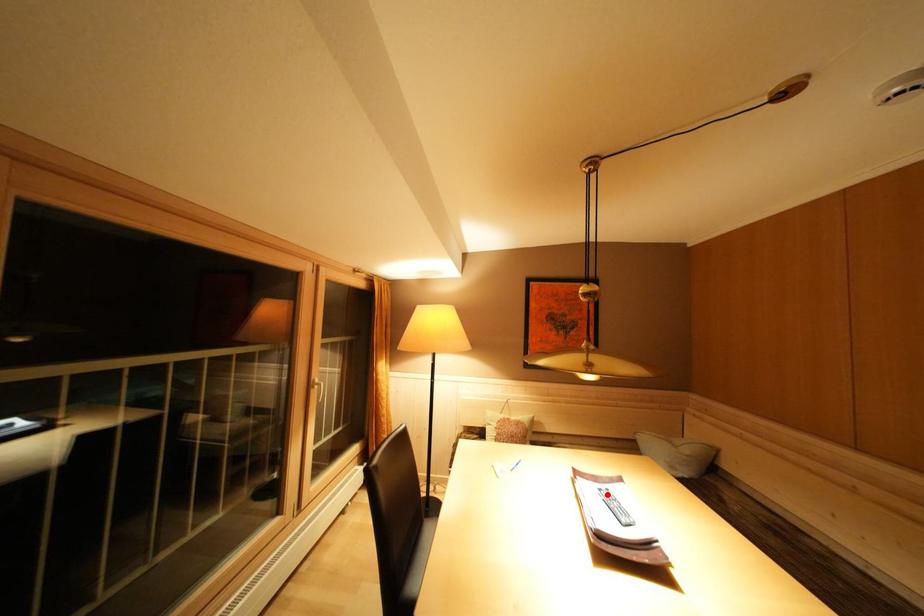
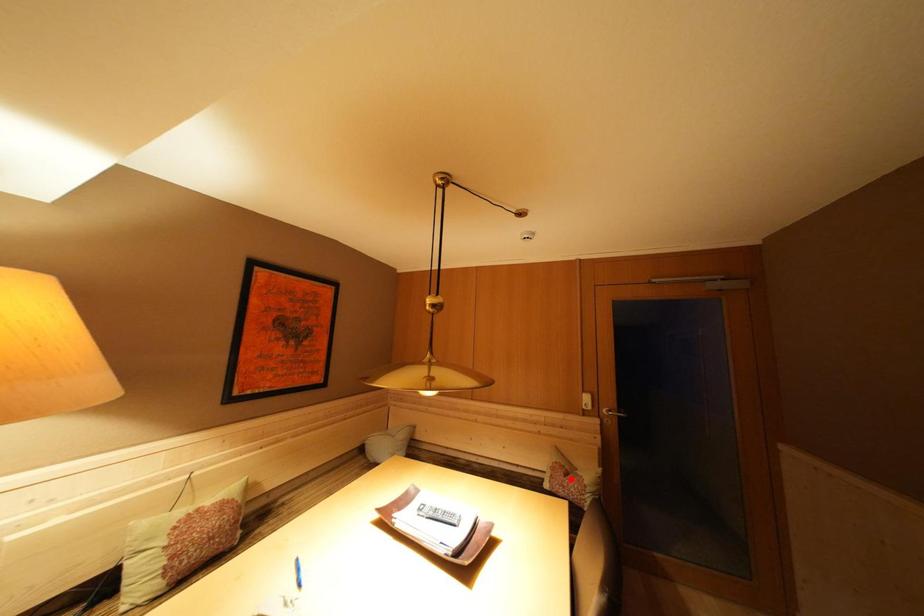
I am providing you with two images of the same scene from different viewpoints. A red point is marked on the first image and another point is marked on the second image. Is the marked point in image1 the same physical position as the marked point in image2?

No